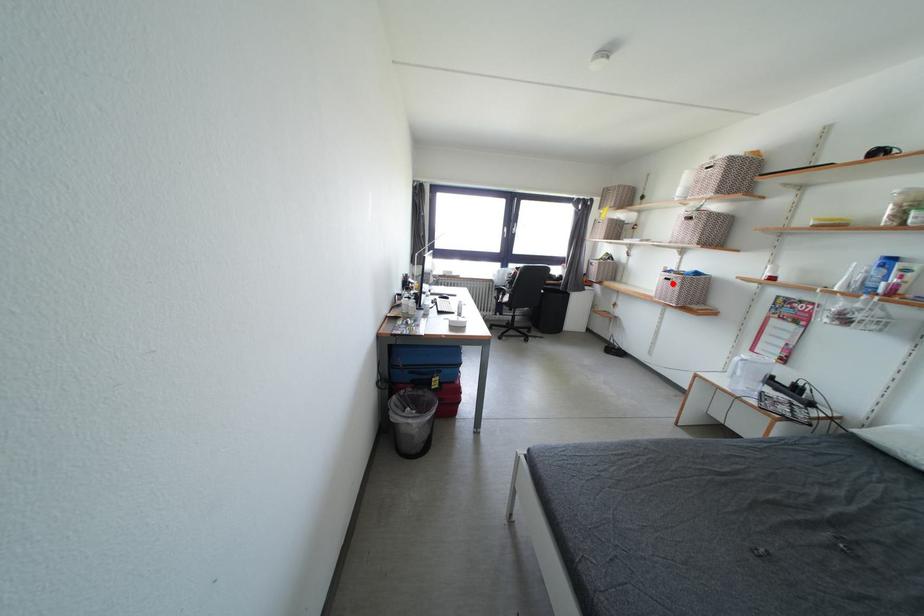
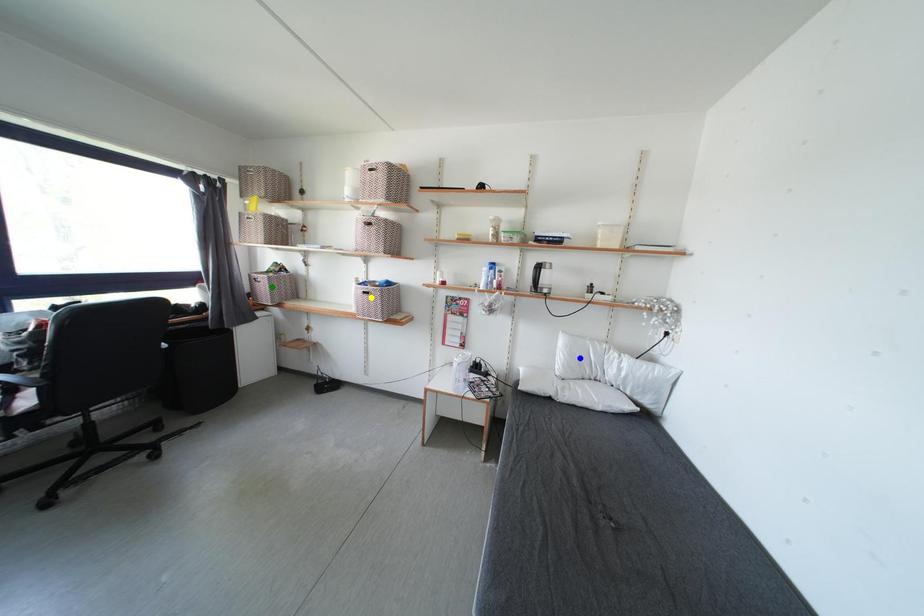
Question: I am providing you with two images of the same scene from different viewpoints. A red point is marked on the first image. You are given multiple points on the second image. In image 2, which mark is for the same physical point as the one in image 1?

Choices:
 (A) blue point
 (B) green point
 (C) yellow point

Answer: (C)